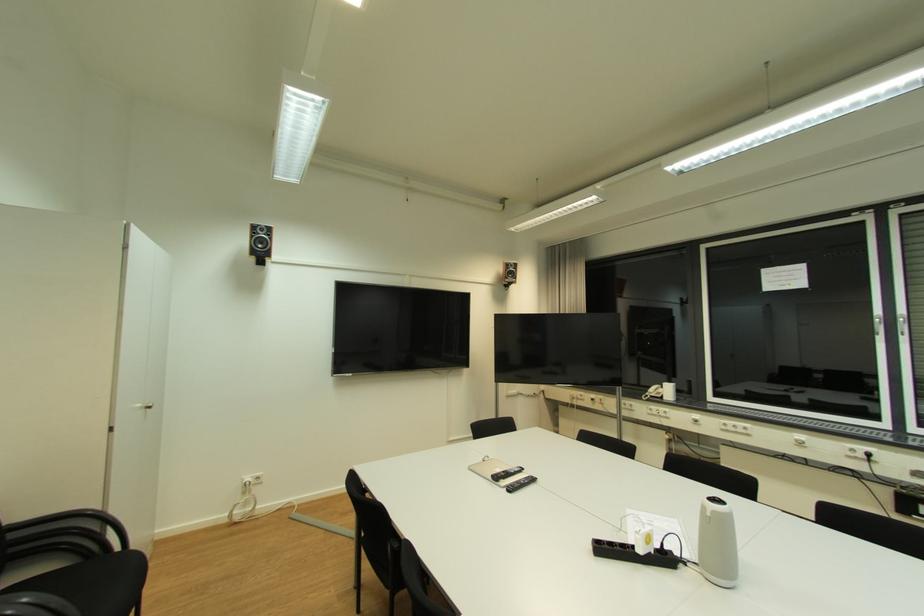
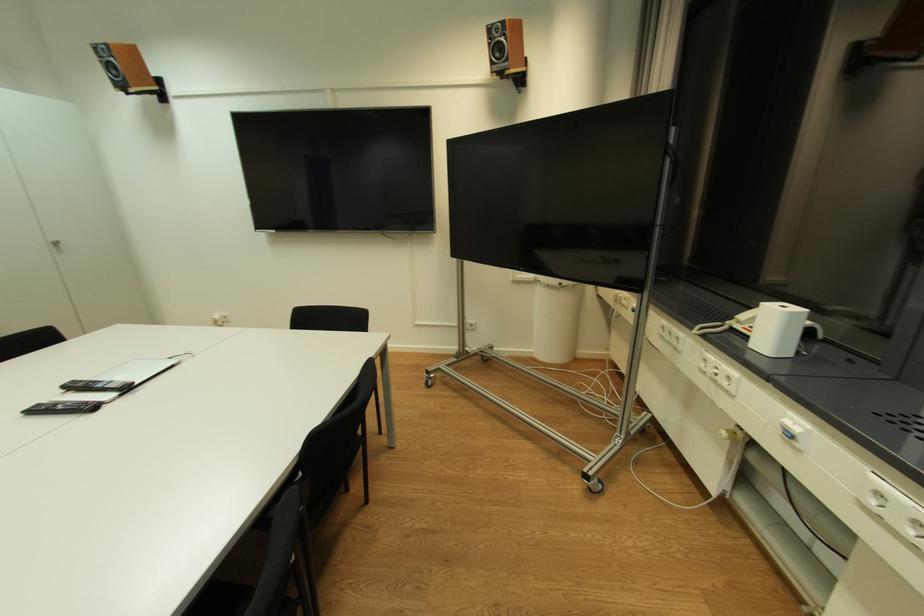
Question: I am providing you with two images of the same scene from different viewpoints. Please identify which objects are invisible in image2.

Choices:
 (A) silver laptop
 (B) white trash can
 (C) black remote control
 (D) none of these

Answer: (D)